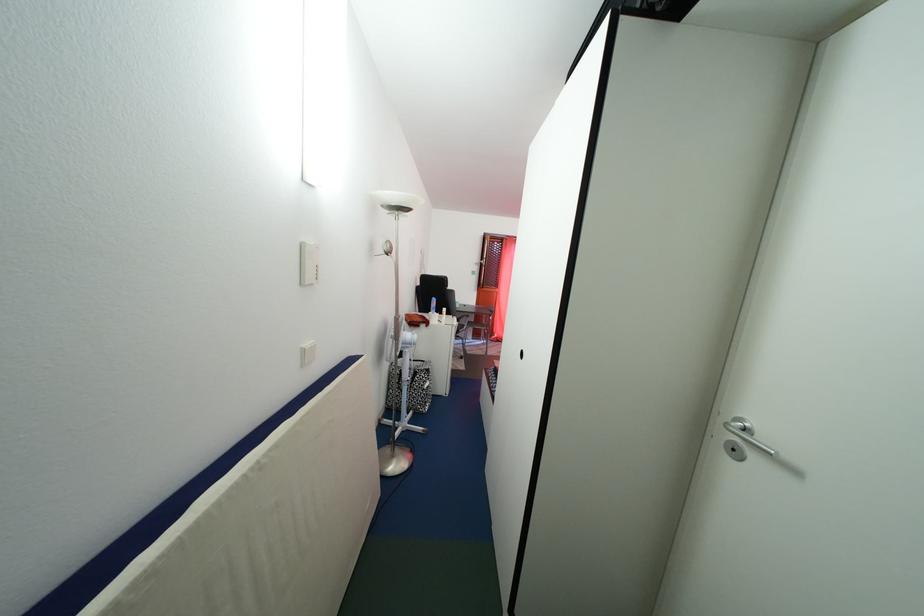
Locate an element on the screen. chair armrest is located at coordinates (463, 318).